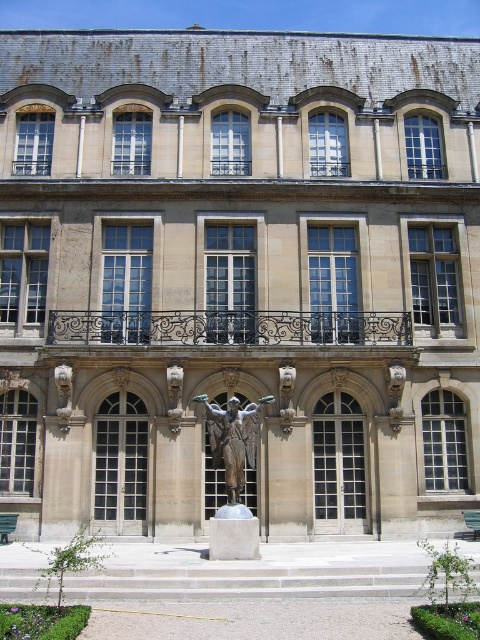
Can you confirm if black wrought iron balcony at center is shorter than bronze statue at center?

Indeed, black wrought iron balcony at center has a lesser height compared to bronze statue at center.

Does black wrought iron balcony at center appear over bronze statue at center?

Indeed, black wrought iron balcony at center is positioned over bronze statue at center.

What are the coordinates of `black wrought iron balcony at center` in the screenshot? It's located at (229, 326).